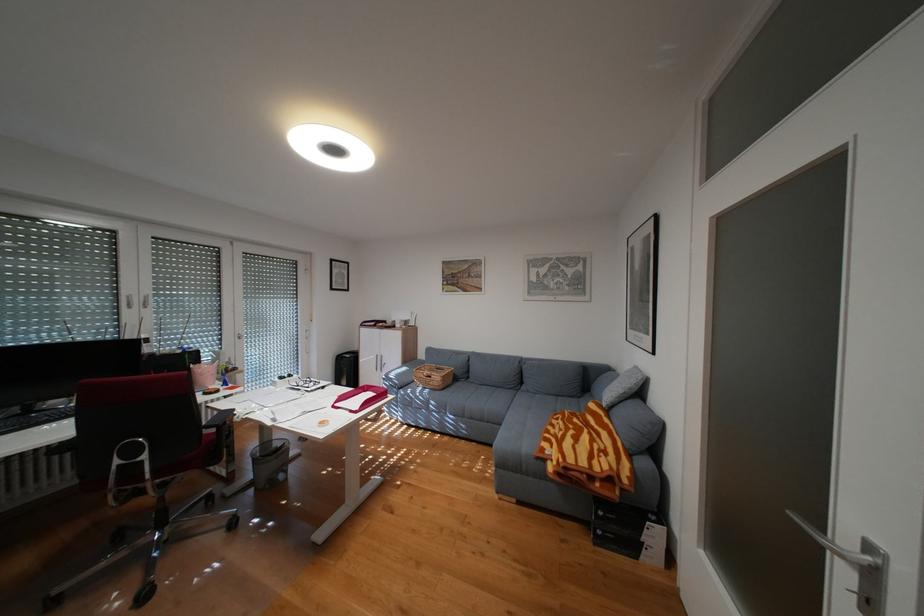
The width and height of the screenshot is (924, 616). I want to click on wicker basket, so (432, 376).